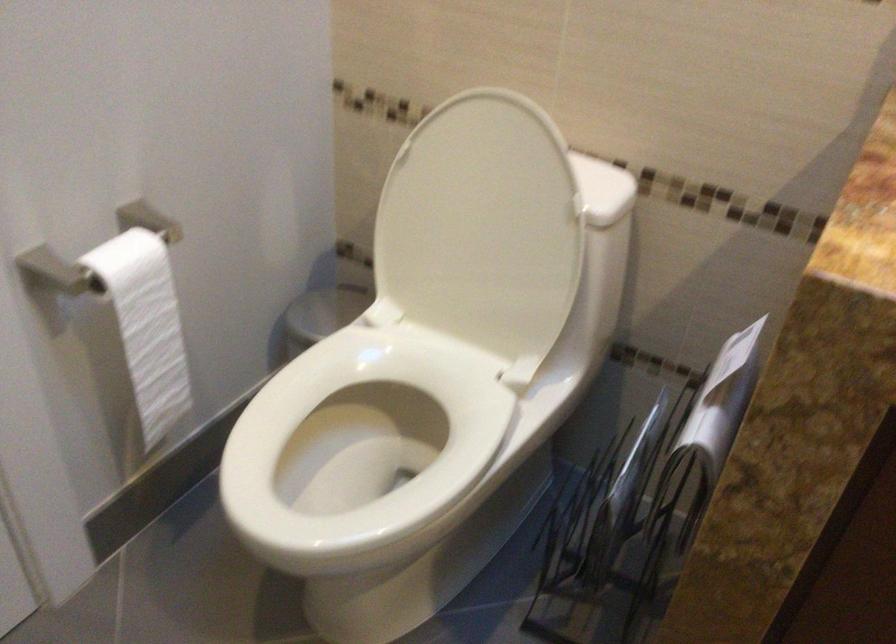
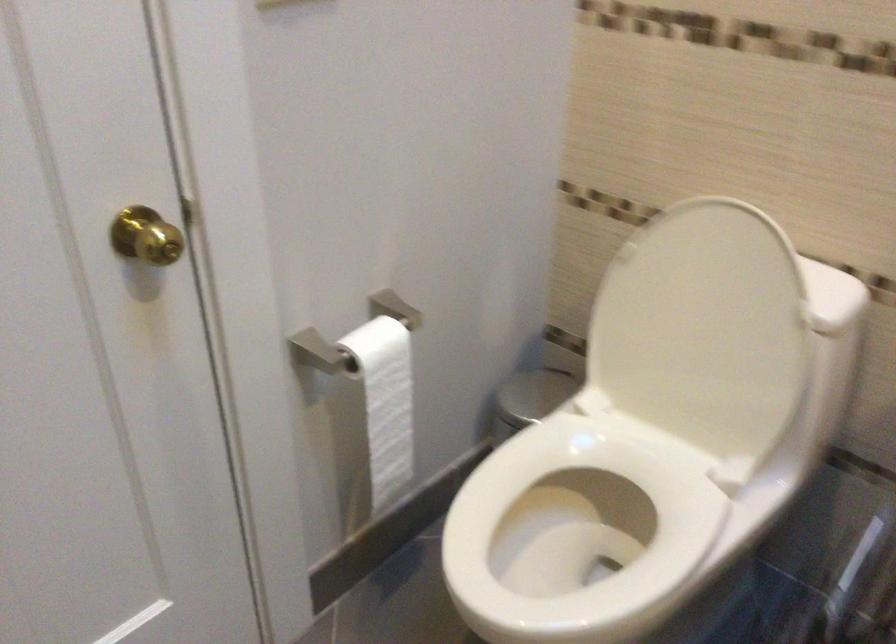
Find the pixel in the second image that matches point (485, 230) in the first image.

(702, 330)